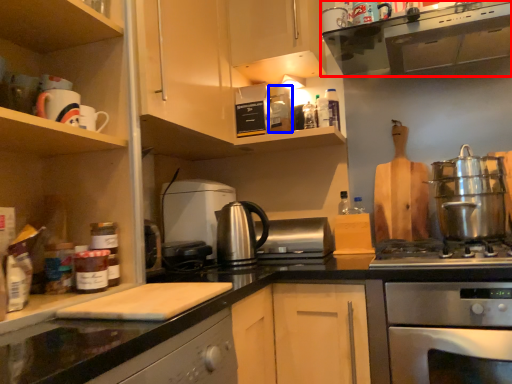
Question: Which object is closer to the camera taking this photo, home appliance (highlighted by a red box) or appliance (highlighted by a blue box)?

Choices:
 (A) home appliance
 (B) appliance

Answer: (A)